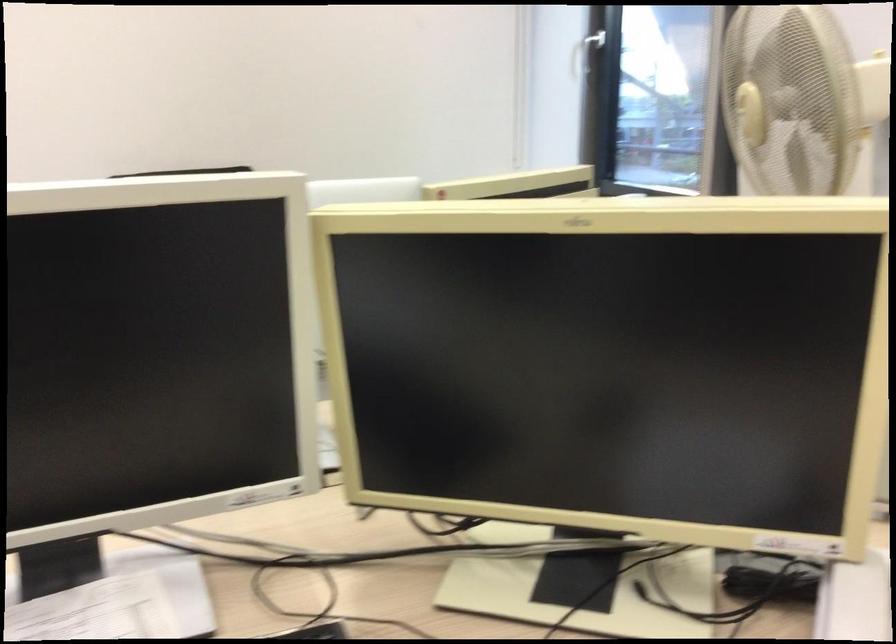
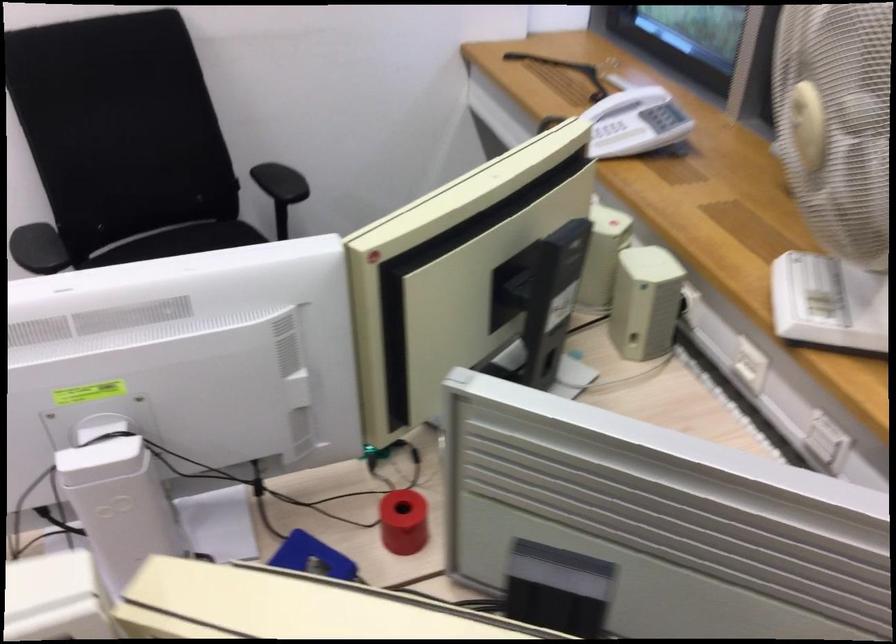
Question: The images are taken continuously from a first-person perspective. In which direction are you moving?

Choices:
 (A) Left
 (B) Right
 (C) Forward
 (D) Backward

Answer: (C)